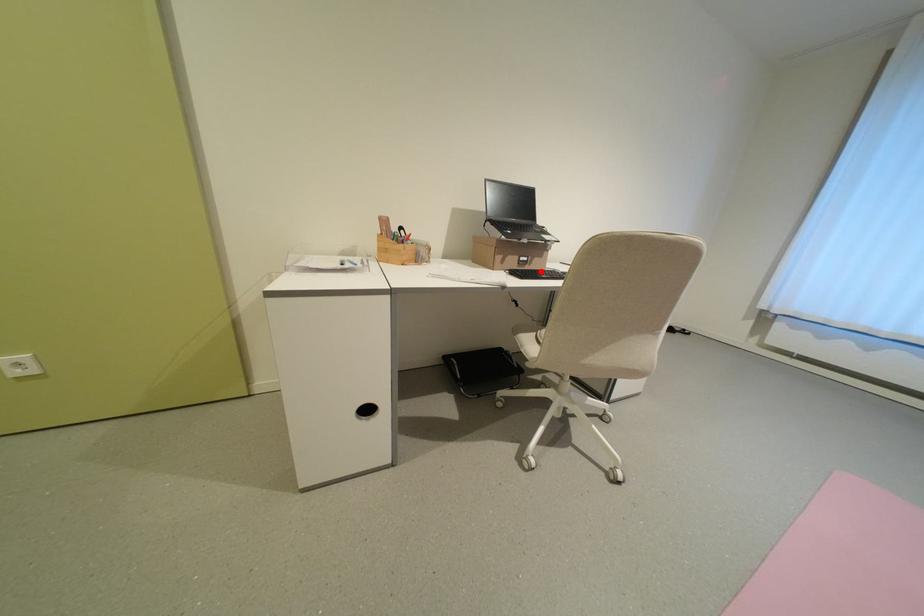
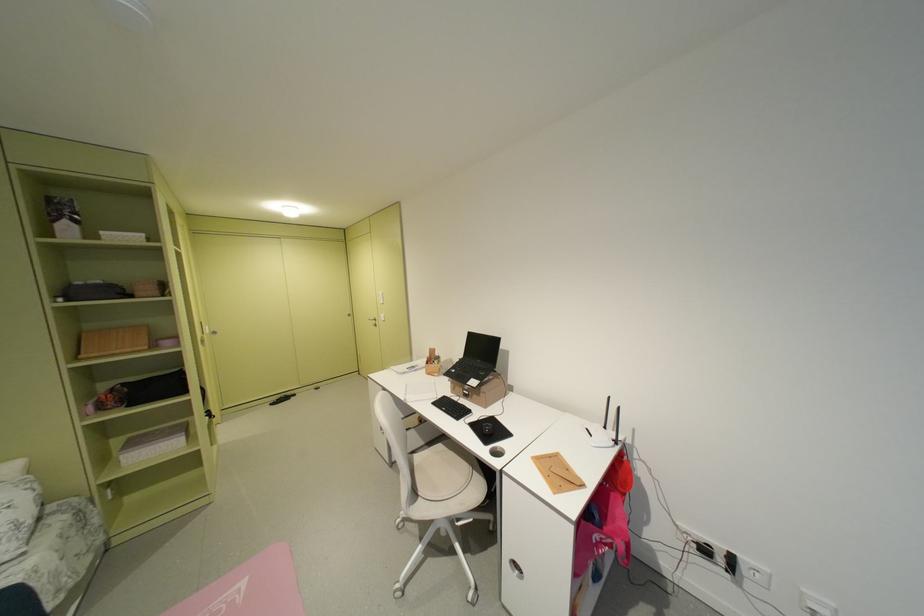
In the second image, find the point that corresponds to the highlighted location in the first image.

(464, 403)